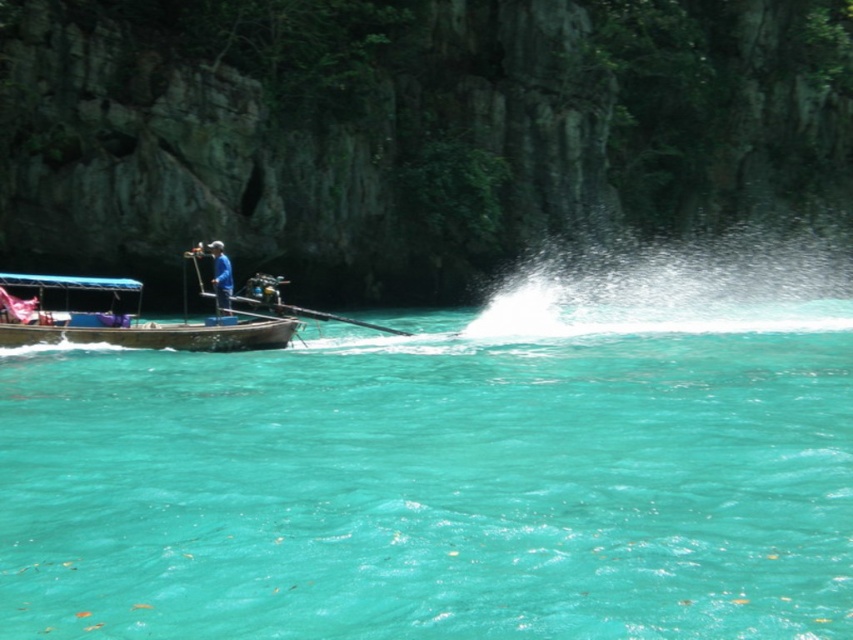
You are a photographer planning to capture the reflection of the brown wooden boat at left in the turquoise clear water at lower left. Based on the scene, can you confirm if the water surface is large enough to fully reflect the boat?

The turquoise clear water at lower left is bigger than brown wooden boat at left, so yes, the water surface is large enough to fully reflect the boat.

You are a passenger on a boat and need to know if you can safely move from the brown wooden boat at left to the blue fabric boat at left. Given that the safe distance for such a transfer is 10 feet or less, can you make the transfer?

The distance between the brown wooden boat at left and the blue fabric boat at left is 9.81 feet, which is within the safe distance of 10 feet or less. Therefore, you can safely make the transfer between the two boats.